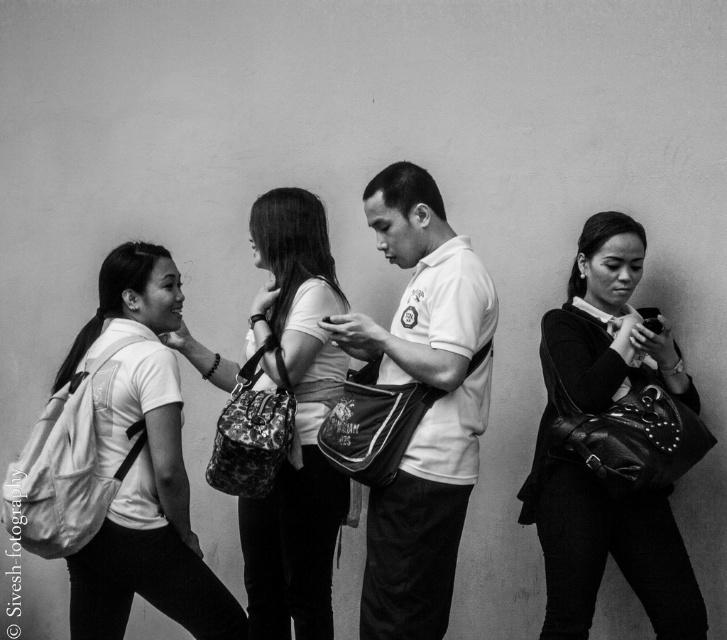
Question: Which of the following is the closest to the observer?

Choices:
 (A) white matte shirt at center
 (B) leather handbag at center
 (C) white fabric backpack at left

Answer: (C)

Question: Can you confirm if leather handbag at center is thinner than white fabric backpack at left?

Choices:
 (A) no
 (B) yes

Answer: (B)

Question: Can you confirm if leather handbag at center is thinner than white fabric backpack at left?

Choices:
 (A) yes
 (B) no

Answer: (A)

Question: Among these points, which one is farthest from the camera?

Choices:
 (A) (563, 605)
 (B) (216, 605)
 (C) (265, 611)

Answer: (C)

Question: Which point is farther to the camera?

Choices:
 (A) white fabric backpack at left
 (B) matte white shirt at center
 (C) leather handbag at center
 (D) white matte shirt at center

Answer: (B)

Question: Does leather handbag at center have a smaller size compared to white fabric backpack at left?

Choices:
 (A) yes
 (B) no

Answer: (B)